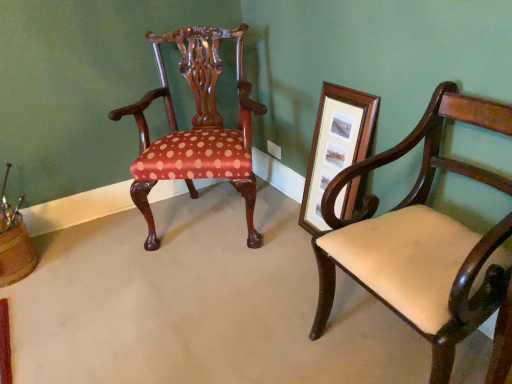
At what (x,y) coordinates should I click in order to perform the action: click on vacant space in matte cream upholstered chair at right, marked as the second chair in a left-to-right arrangement (from a real-world perspective). Please return your answer as a coordinate pair (x, y). The height and width of the screenshot is (384, 512). Looking at the image, I should click on (388, 349).